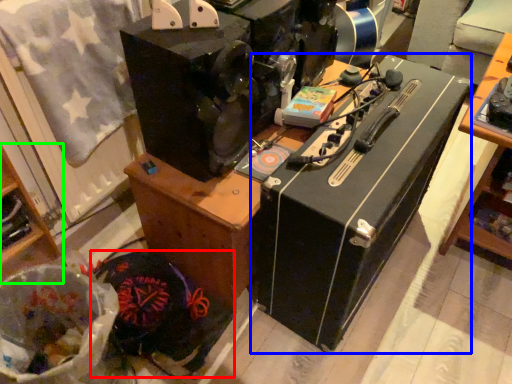
Question: Estimate the real-world distances between objects in this image. Which object is farther from waste (highlighted by a red box), wide (highlighted by a blue box) or furniture (highlighted by a green box)?

Choices:
 (A) wide
 (B) furniture

Answer: (A)